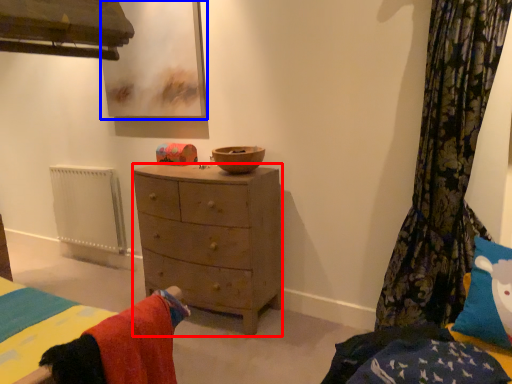
Question: Which object is further to the camera taking this photo, nightstand (highlighted by a red box) or picture frame (highlighted by a blue box)?

Choices:
 (A) nightstand
 (B) picture frame

Answer: (B)